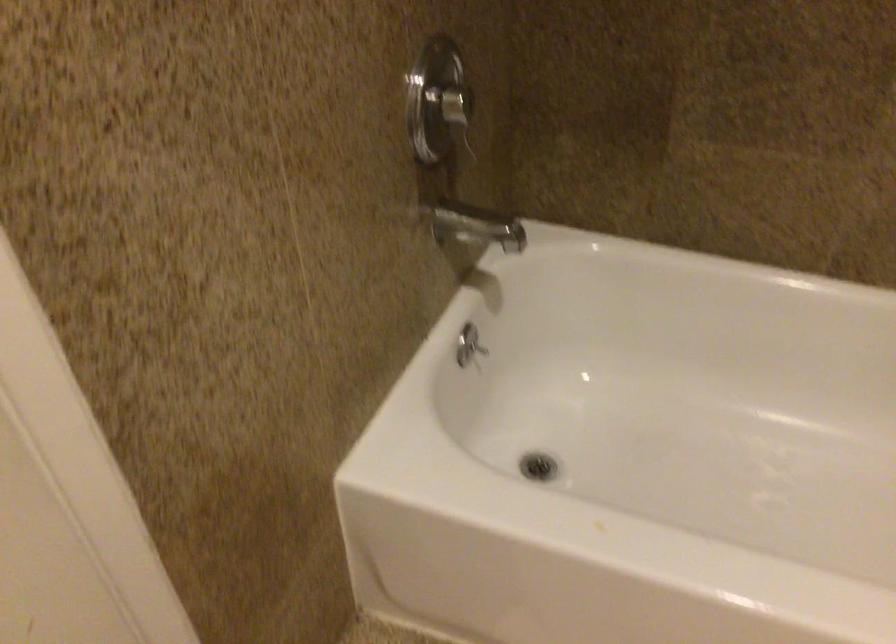
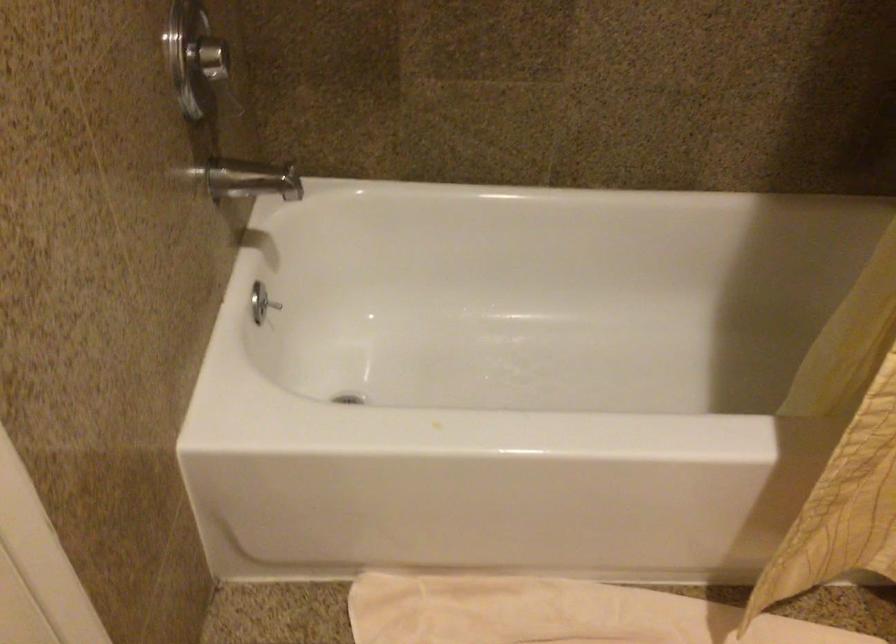
Question: Based on the continuous images, in which direction is the camera rotating? Reply with the corresponding letter.

Choices:
 (A) Left
 (B) Right
 (C) Up
 (D) Down

Answer: (B)